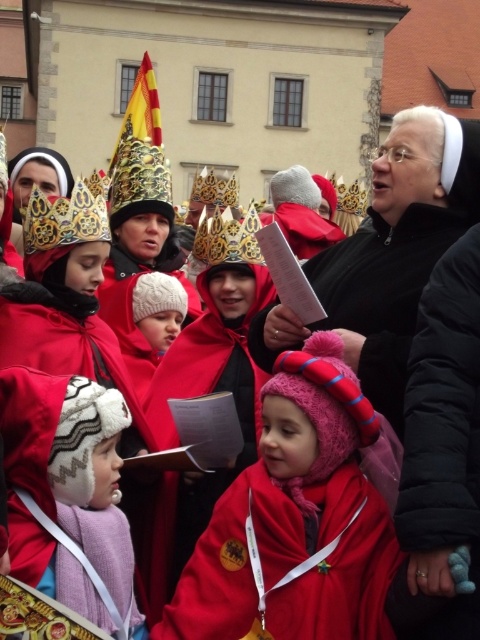
Question: Which of the following is the farthest from the observer?

Choices:
 (A) (333, 477)
 (B) (101, 208)
 (C) (124, 536)

Answer: (B)

Question: Can you confirm if fuzzy pink hat at center is positioned to the right of gold metallic crown at upper left?

Choices:
 (A) no
 (B) yes

Answer: (B)

Question: Which point is closer to the camera?

Choices:
 (A) fuzzy pink hat at center
 (B) fuzzy white hat at lower left

Answer: (A)

Question: Which of the following is the farthest from the observer?

Choices:
 (A) gold metallic crown at upper left
 (B) fuzzy pink hat at center
 (C) fuzzy white hat at lower left

Answer: (A)

Question: Is fuzzy pink hat at center further to the viewer compared to fuzzy white hat at lower left?

Choices:
 (A) yes
 (B) no

Answer: (B)

Question: Can you confirm if fuzzy pink hat at center is positioned above fuzzy white hat at lower left?

Choices:
 (A) yes
 (B) no

Answer: (A)